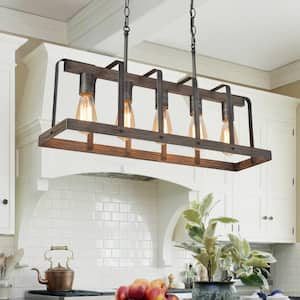
Find the location of a particular element. cabinet is located at coordinates (267, 184).